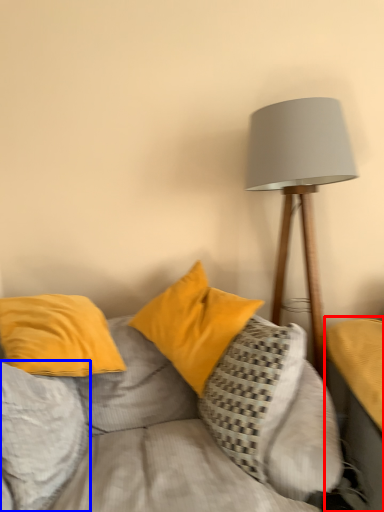
Question: Which point is further to the camera, table (highlighted by a red box) or pillow (highlighted by a blue box)?

Choices:
 (A) table
 (B) pillow

Answer: (B)